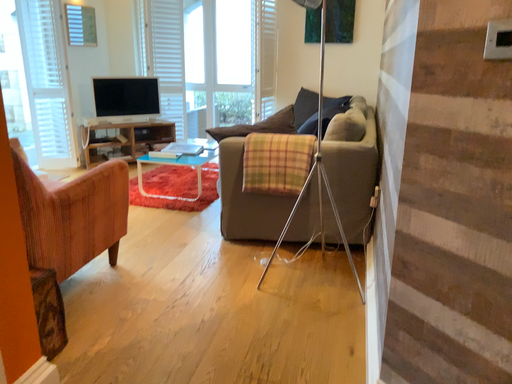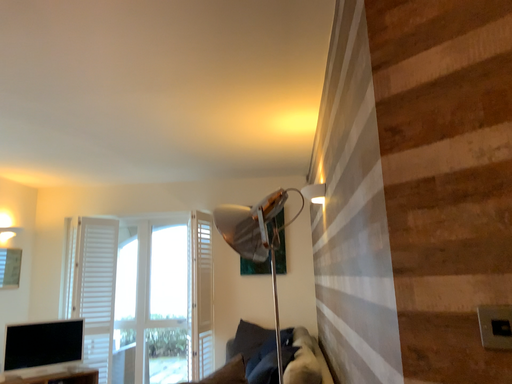
Question: Which way did the camera rotate in the video?

Choices:
 (A) rotated downward
 (B) rotated upward

Answer: (B)